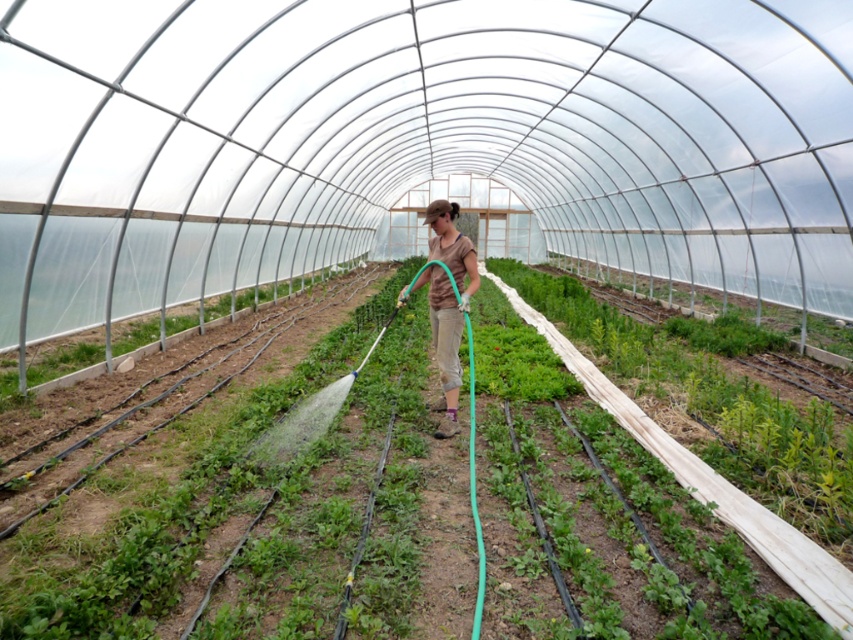
Does green leafy plant at center have a greater width compared to green leafy plant at left?

No.

Does green leafy plant at center have a greater height compared to green leafy plant at left?

In fact, green leafy plant at center may be shorter than green leafy plant at left.

Who is more forward, (45, 625) or (86, 358)?

Point (45, 625)

At what (x,y) coordinates should I click in order to perform the action: click on green leafy plant at center. Please return your answer as a coordinate pair (x, y). This screenshot has width=853, height=640. Looking at the image, I should click on (265, 518).

In the scene shown: Does brown cotton shirt at center have a lesser width compared to green leafy plant at left?

Yes, brown cotton shirt at center is thinner than green leafy plant at left.

Is the position of brown cotton shirt at center less distant than that of green leafy plant at left?

Yes, it is in front of green leafy plant at left.

Find the location of a particular element. This screenshot has width=853, height=640. brown cotton shirt at center is located at coordinates (445, 301).

Identify the location of brown cotton shirt at center. (445, 301).

Does green leafy plant at center lie in front of brown cotton shirt at center?

Yes, green leafy plant at center is closer to the viewer.

Does green leafy plant at center appear on the right side of brown cotton shirt at center?

Indeed, green leafy plant at center is positioned on the right side of brown cotton shirt at center.

In the scene shown: Who is more forward, (701, 516) or (431, 269)?

Positioned in front is point (701, 516).

You are a GUI agent. You are given a task and a screenshot of the screen. Output one action in this format:
    pyautogui.click(x=<x>, y=<y>)
    Task: Click on the green leafy plant at center
    The width and height of the screenshot is (853, 640).
    Given the screenshot: What is the action you would take?
    pyautogui.click(x=265, y=518)